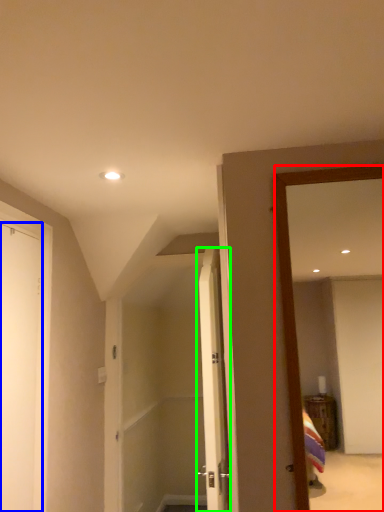
Question: Which object is the closest to the mirror (highlighted by a red box)? Choose among these: door (highlighted by a blue box) or door (highlighted by a green box).

Choices:
 (A) door
 (B) door

Answer: (B)